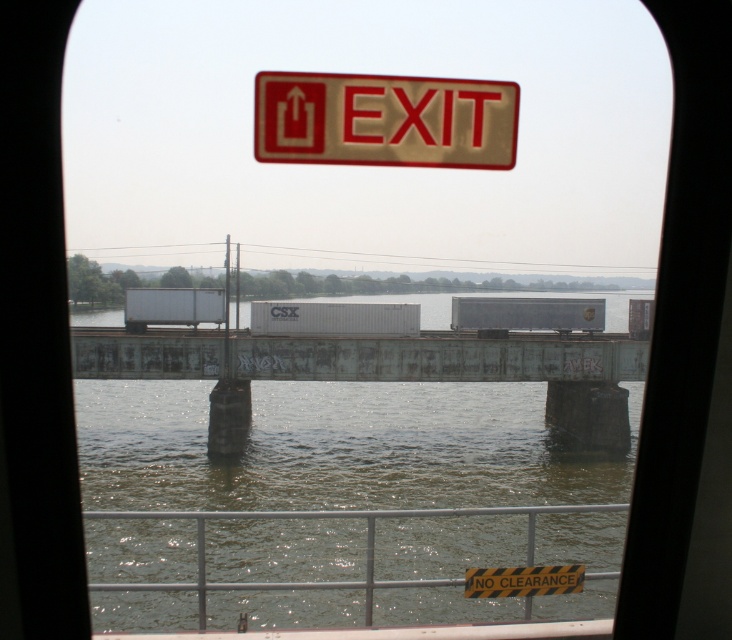
Can you confirm if rusty metal bridge at center is positioned above gold textured exit sign at upper center?

Incorrect, rusty metal bridge at center is not positioned above gold textured exit sign at upper center.

Is rusty metal bridge at center wider than gold textured exit sign at upper center?

Correct, the width of rusty metal bridge at center exceeds that of gold textured exit sign at upper center.

Does point (130, 378) lie in front of point (340, 163)?

No, (130, 378) is further to viewer.

This screenshot has width=732, height=640. In order to click on rusty metal bridge at center in this screenshot , I will do `click(381, 371)`.